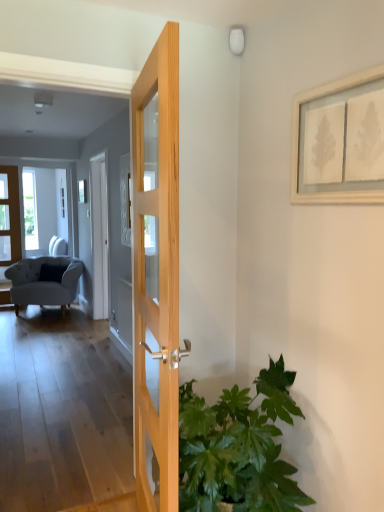
Question: Is white wooden picture frame at upper right facing away from green leafy plant at lower right?

Choices:
 (A) yes
 (B) no

Answer: (B)

Question: Could you tell me if white wooden picture frame at upper right is facing green leafy plant at lower right?

Choices:
 (A) yes
 (B) no

Answer: (B)

Question: Is green leafy plant at lower right inside white wooden picture frame at upper right?

Choices:
 (A) no
 (B) yes

Answer: (A)

Question: From the image's perspective, is white wooden picture frame at upper right below green leafy plant at lower right?

Choices:
 (A) no
 (B) yes

Answer: (A)

Question: From the image's perspective, does white wooden picture frame at upper right appear higher than green leafy plant at lower right?

Choices:
 (A) no
 (B) yes

Answer: (B)

Question: Are white wooden picture frame at upper right and green leafy plant at lower right located far from each other?

Choices:
 (A) yes
 (B) no

Answer: (B)

Question: Can you confirm if green leafy plant at lower right is smaller than natural wood door at center, the first door when ordered from right to left?

Choices:
 (A) yes
 (B) no

Answer: (B)

Question: Does green leafy plant at lower right lie behind natural wood door at center, the first door when ordered from right to left?

Choices:
 (A) no
 (B) yes

Answer: (B)

Question: Is green leafy plant at lower right completely or partially outside of natural wood door at center, arranged as the 2th door when viewed from the left?

Choices:
 (A) yes
 (B) no

Answer: (A)

Question: Is green leafy plant at lower right closer to camera compared to natural wood door at center, marked as the second door in a back-to-front arrangement?

Choices:
 (A) no
 (B) yes

Answer: (A)

Question: Is green leafy plant at lower right aimed at natural wood door at center, acting as the 1th door starting from the front?

Choices:
 (A) yes
 (B) no

Answer: (A)

Question: From the image's perspective, is green leafy plant at lower right over natural wood door at center, acting as the 1th door starting from the front?

Choices:
 (A) no
 (B) yes

Answer: (A)

Question: Considering the relative positions of matte wooden door at left, which is the second door in right-to-left order, and white wooden picture frame at upper right in the image provided, is matte wooden door at left, which is the second door in right-to-left order, to the left of white wooden picture frame at upper right from the viewer's perspective?

Choices:
 (A) yes
 (B) no

Answer: (A)